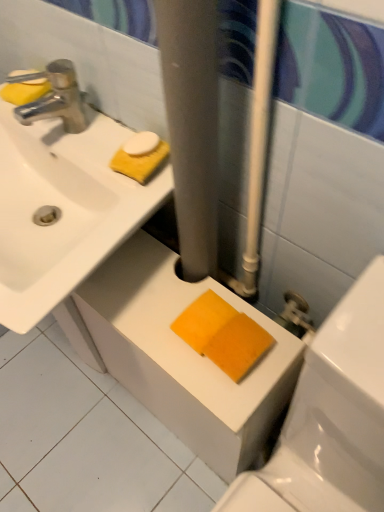
Question: Is white glossy ceramic tile at lower center positioned far away from orange sponge at lower center?

Choices:
 (A) no
 (B) yes

Answer: (A)

Question: Does white glossy ceramic tile at lower center come in front of orange sponge at lower center?

Choices:
 (A) no
 (B) yes

Answer: (A)

Question: From a real-world perspective, is white glossy ceramic tile at lower center under orange sponge at lower center?

Choices:
 (A) no
 (B) yes

Answer: (B)

Question: Is white glossy ceramic tile at lower center completely or partially outside of orange sponge at lower center?

Choices:
 (A) yes
 (B) no

Answer: (A)

Question: Is white glossy ceramic tile at lower center aimed at orange sponge at lower center?

Choices:
 (A) yes
 (B) no

Answer: (B)

Question: Is the position of white glossy ceramic tile at lower center more distant than that of orange sponge at lower center?

Choices:
 (A) yes
 (B) no

Answer: (A)

Question: From the image's perspective, is orange sponge at lower center located above yellow sponge at upper left, the 2th soap in the top-to-bottom sequence?

Choices:
 (A) yes
 (B) no

Answer: (B)

Question: From the image's perspective, is orange sponge at lower center beneath yellow sponge at upper left, which ranks as the 1th soap in bottom-to-top order?

Choices:
 (A) no
 (B) yes

Answer: (B)

Question: Considering the relative sizes of orange sponge at lower center and yellow sponge at upper left, which ranks as the 1th soap in bottom-to-top order, in the image provided, is orange sponge at lower center wider than yellow sponge at upper left, which ranks as the 1th soap in bottom-to-top order,?

Choices:
 (A) no
 (B) yes

Answer: (B)

Question: Can you confirm if orange sponge at lower center is thinner than yellow sponge at upper left, the 2th soap in the top-to-bottom sequence?

Choices:
 (A) no
 (B) yes

Answer: (A)

Question: Is orange sponge at lower center to the left of yellow sponge at upper left, which ranks as the 1th soap in bottom-to-top order, from the viewer's perspective?

Choices:
 (A) no
 (B) yes

Answer: (A)

Question: Is orange sponge at lower center positioned in front of yellow sponge at upper left, which ranks as the 1th soap in bottom-to-top order?

Choices:
 (A) yes
 (B) no

Answer: (A)

Question: Is white glossy sink at upper left located outside chrome metallic faucet at upper left?

Choices:
 (A) no
 (B) yes

Answer: (B)